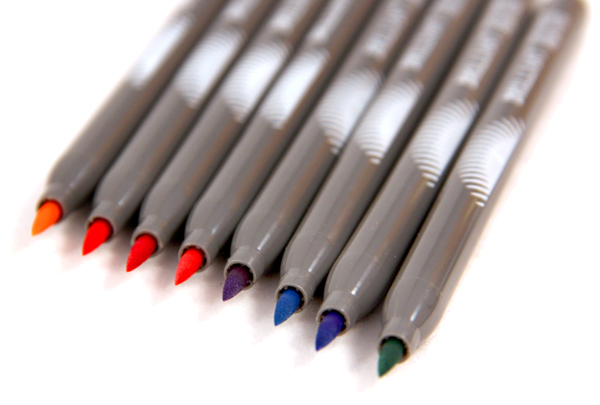
Where is `red and orange markers`? This screenshot has width=600, height=405. red and orange markers is located at coordinates point(41,217), point(90,234), point(139,255), point(189,270).